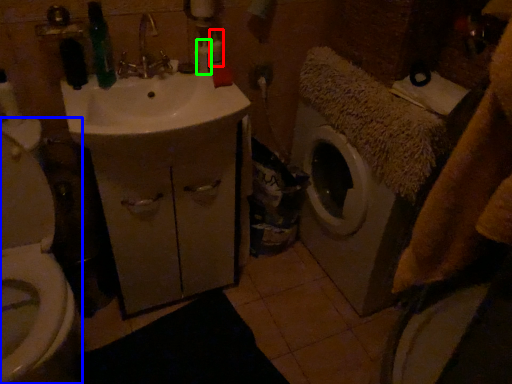
Question: Estimate the real-world distances between objects in this image. Which object is closer to toiletry (highlighted by a red box), toilet (highlighted by a blue box) or toiletry (highlighted by a green box)?

Choices:
 (A) toilet
 (B) toiletry

Answer: (B)